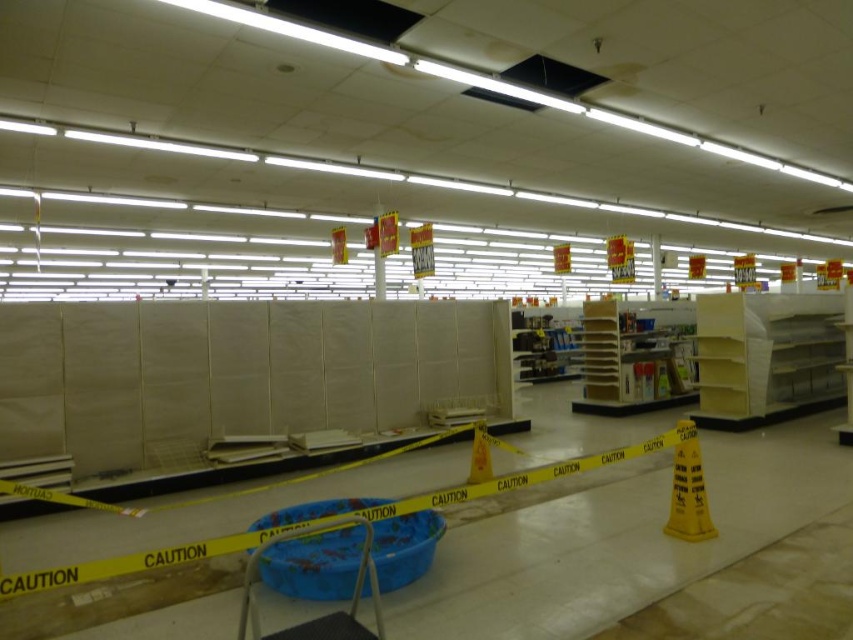
Between point (752, 330) and point (471, 480), which one is positioned behind?

The point (752, 330) is behind.

I want to click on yellow matte shelf at center, so click(x=767, y=356).

Image resolution: width=853 pixels, height=640 pixels. What do you see at coordinates (767, 356) in the screenshot?
I see `yellow matte shelf at center` at bounding box center [767, 356].

Identify the location of yellow matte shelf at center. (767, 356).

Does wooden shelves at center have a lesser width compared to yellow caution cone at lower right?

No, wooden shelves at center is not thinner than yellow caution cone at lower right.

Does wooden shelves at center have a larger size compared to yellow caution cone at lower right?

Yes.

You are a GUI agent. You are given a task and a screenshot of the screen. Output one action in this format:
    pyautogui.click(x=<x>, y=<y>)
    Task: Click on the wooden shelves at center
    The image size is (853, 640).
    Given the screenshot: What is the action you would take?
    pyautogui.click(x=631, y=362)

Does point (675, 470) lie behind point (477, 442)?

No.

Describe the element at coordinates (688, 490) in the screenshot. The image size is (853, 640). I see `yellow caution cone at lower right` at that location.

What do you see at coordinates (688, 490) in the screenshot? I see `yellow caution cone at lower right` at bounding box center [688, 490].

This screenshot has width=853, height=640. In order to click on yellow caution cone at lower right in this screenshot , I will do `click(688, 490)`.